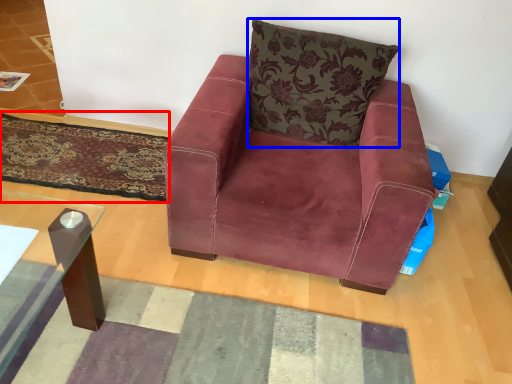
Question: Which object appears closest to the camera in this image, mat (highlighted by a red box) or pillow (highlighted by a blue box)?

Choices:
 (A) mat
 (B) pillow

Answer: (B)